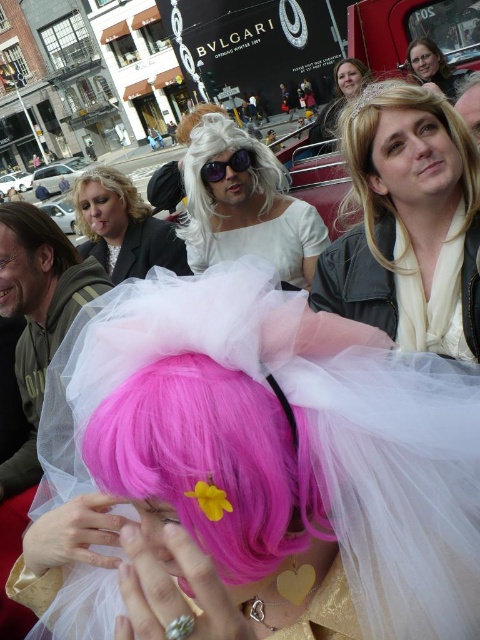
You are a photographer at the event and want to capture a photo that includes both the blonde silky hair at upper right and the blonde hair at upper center. Which of the two should you focus on first if you want to highlight the shorter one?

The blonde silky hair at upper right is shorter than the blonde hair at upper center, so you should focus on the blonde silky hair at upper right first to highlight the shorter one.

You are standing in the middle of the urban scene described. There is a point marked at coordinates (38,314). What object is located at this point?

The pink tulle wig at center is located at point (38,314).

Based on the photo, you are standing at the center of the scene and want to locate the pink tulle wig at lower center. Which direction should you look to find it?

You should look downward and to the lower center direction to find the pink tulle wig at lower center, as it is positioned at point (x=212, y=460) in the scene.